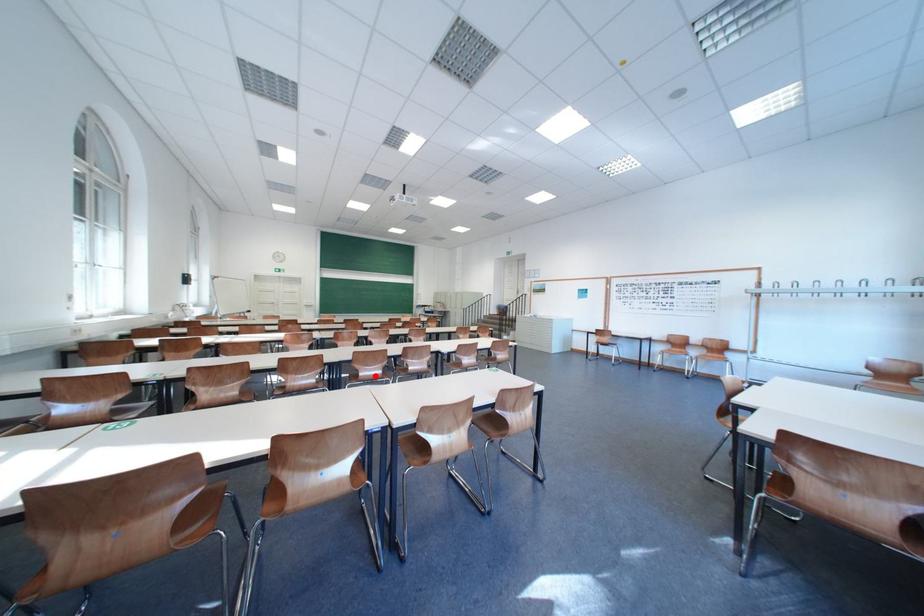
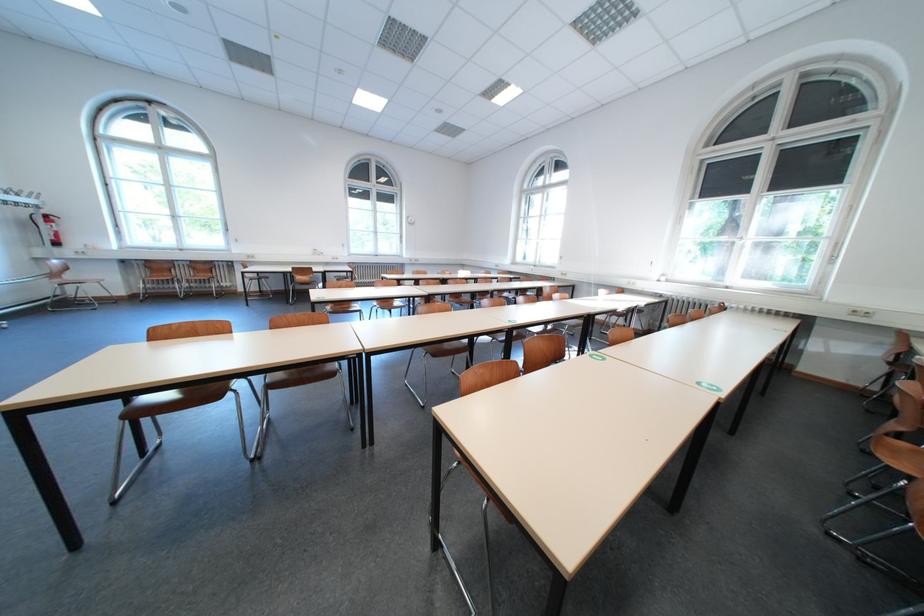
Question: I am providing you with two images of the same scene from different viewpoints. A red point is marked on the first image. Is the red point's position out of view in image 2?

Choices:
 (A) Yes
 (B) No

Answer: (A)